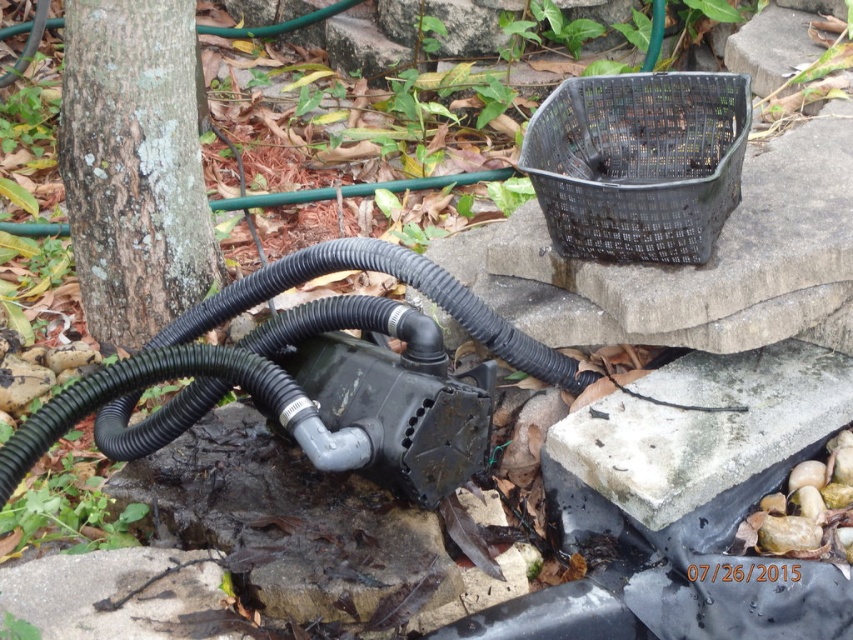
You are a gardener holding a 1.5 meter long tool. You need to reach the black rubber hose at lower left to connect it to the pump. Can you reach it without moving closer?

The black rubber hose at lower left is 1.82 meters from the camera. Since your tool is 1.5 meters long, you cannot reach it without moving closer.

You are standing in the garden and want to place a new decorative stone between the two points labeled as point [579,116] and point [735,474]. Which point should you start from to ensure the stone is closer to the pump?

You should start from point [579,116] because it is closer to the pump than point [735,474].

You are standing in the garden and want to place a small decoration between the two points marked as point (123, 372) and point (802, 387). Which point should you place it closer to so it appears larger in the image?

You should place the decoration closer to point (123, 372) because it is closer to the viewer, making objects placed there appear larger in the image compared to point (802, 387) which is farther away.